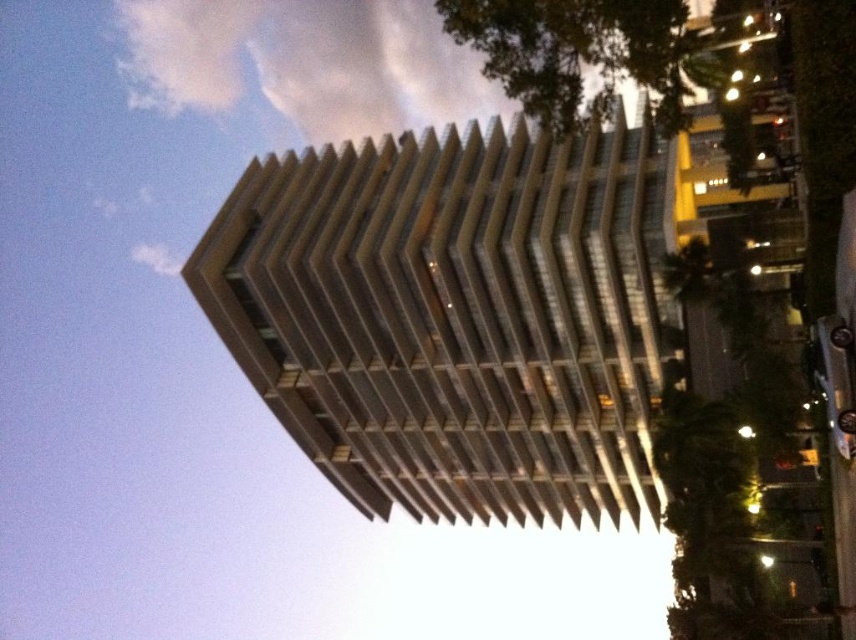
Question: Can you confirm if sandy beige concrete building at center is wider than white fluffy cloud at upper center?

Choices:
 (A) no
 (B) yes

Answer: (A)

Question: Does sandy beige concrete building at center appear on the right side of white fluffy cloud at upper center?

Choices:
 (A) yes
 (B) no

Answer: (A)

Question: Can you confirm if sandy beige concrete building at center is positioned to the right of white fluffy cloud at upper center?

Choices:
 (A) yes
 (B) no

Answer: (A)

Question: Which object appears closest to the camera in this image?

Choices:
 (A) white fluffy cloud at upper center
 (B) sandy beige concrete building at center

Answer: (A)